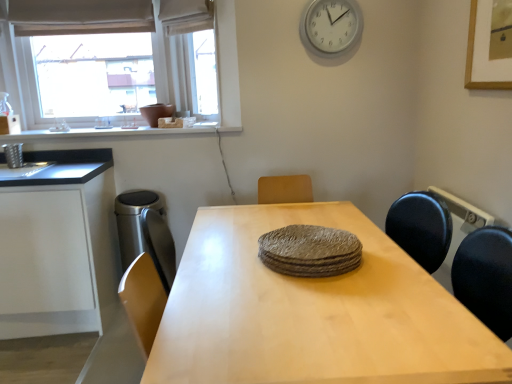
I want to click on spots to the right of textured gray plates at center, so click(390, 261).